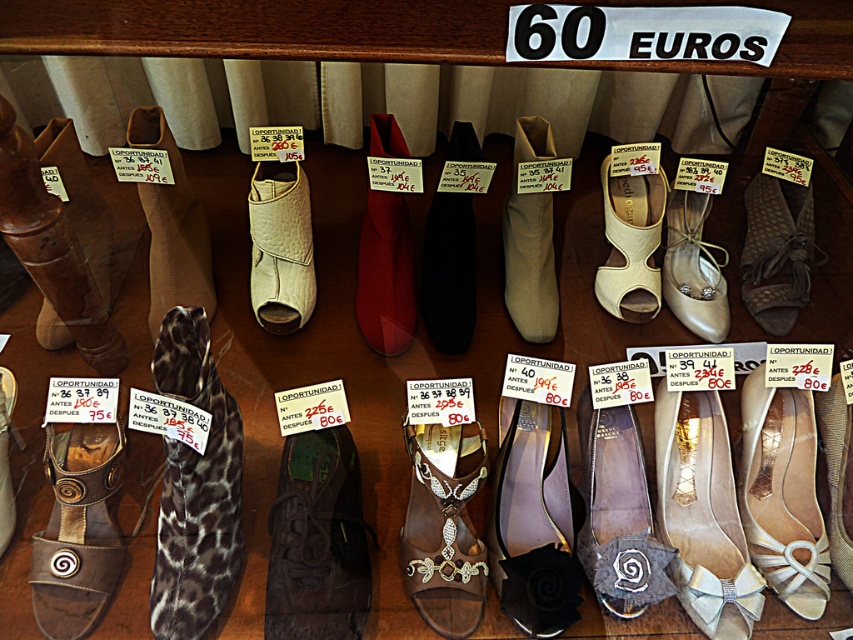
Question: Which point is farther to the camera?

Choices:
 (A) (744, 486)
 (B) (579, 573)
 (C) (340, 465)
 (D) (186, 284)

Answer: (D)

Question: Is brown leather sandal at lower left above leopard print sandal at center?

Choices:
 (A) yes
 (B) no

Answer: (B)

Question: Is brown leather boot at left behind leopard print sandal at center?

Choices:
 (A) yes
 (B) no

Answer: (B)

Question: Which point appears closest to the camera in this image?

Choices:
 (A) pos(189,269)
 (B) pos(462,492)
 (C) pos(592,518)
 (D) pos(723,637)

Answer: (B)

Question: Is beige fabric flat at center behind leopard print sandal at center?

Choices:
 (A) yes
 (B) no

Answer: (A)

Question: Among these points, which one is nearest to the camera?

Choices:
 (A) (x=471, y=196)
 (B) (x=608, y=236)
 (C) (x=181, y=381)

Answer: (C)